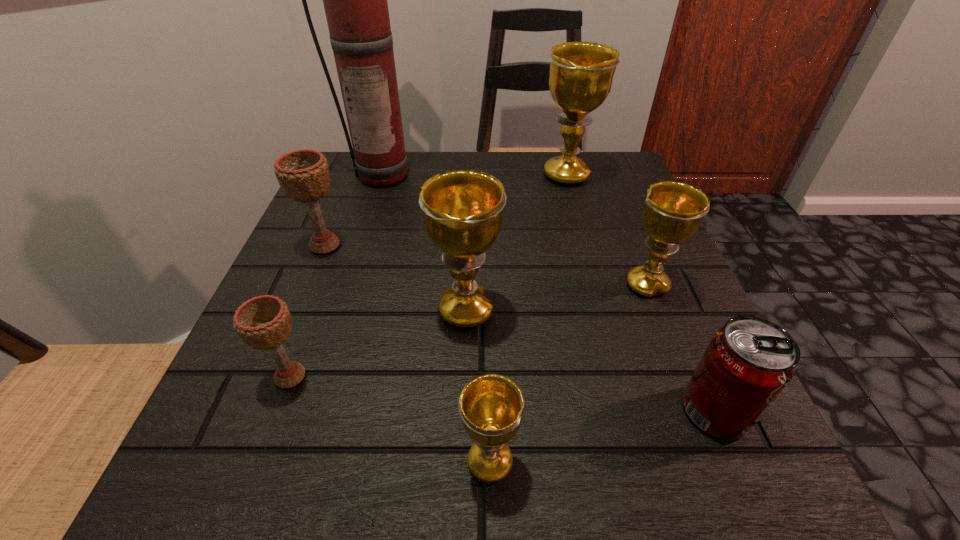
Where is `red fire extinguisher`? red fire extinguisher is located at coordinates (355, 0).

Find the location of a particular element. Image resolution: width=960 pixels, height=540 pixels. fire extinguisher is located at coordinates (355, 0).

This screenshot has height=540, width=960. I want to click on the second tallest object, so click(581, 74).

Locate an element on the screen. the biggest gold chalice is located at coordinates (581, 74).

Locate an element on the screen. Image resolution: width=960 pixels, height=540 pixels. the sixth shortest object is located at coordinates (462, 209).

The image size is (960, 540). What are the coordinates of `the fifth shortest chalice` in the screenshot? It's located at (462, 209).

The image size is (960, 540). In order to click on the third biggest gold chalice in this screenshot , I will do `click(673, 211)`.

Locate an element on the screen. the second farthest chalice is located at coordinates (303, 174).

Where is `the third farthest object`? The height and width of the screenshot is (540, 960). the third farthest object is located at coordinates (303, 174).

Where is `red pop soda`? red pop soda is located at coordinates (748, 363).